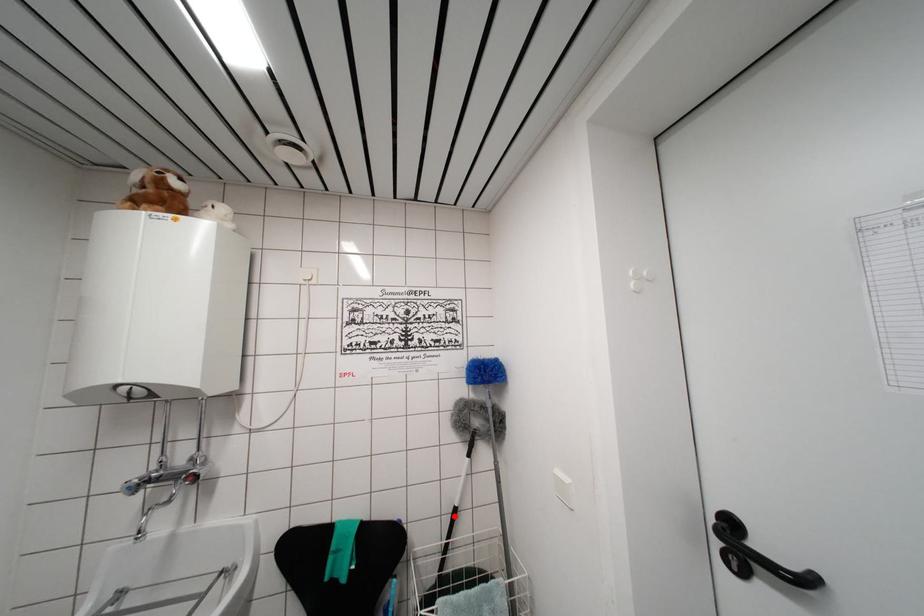
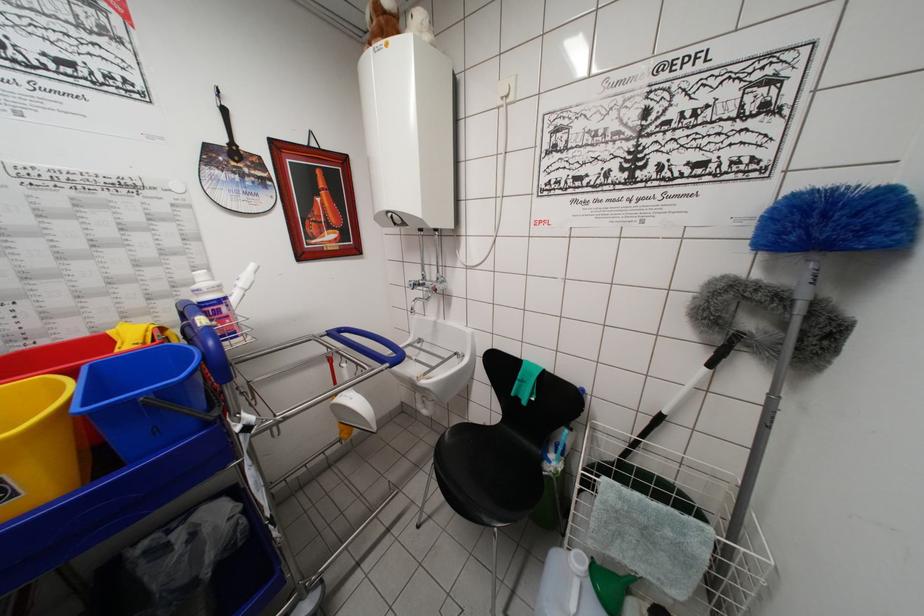
Question: I am providing you with two images of the same scene from different viewpoints. Given a red point in image1, look at the same physical point in image2. Is it:

Choices:
 (A) Closer to the viewpoint
 (B) Farther from the viewpoint

Answer: (A)